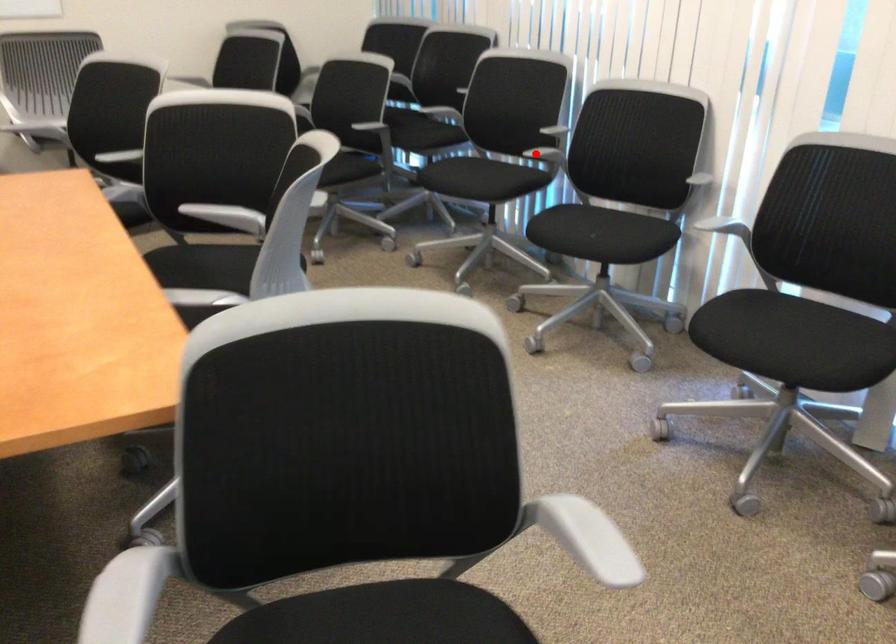
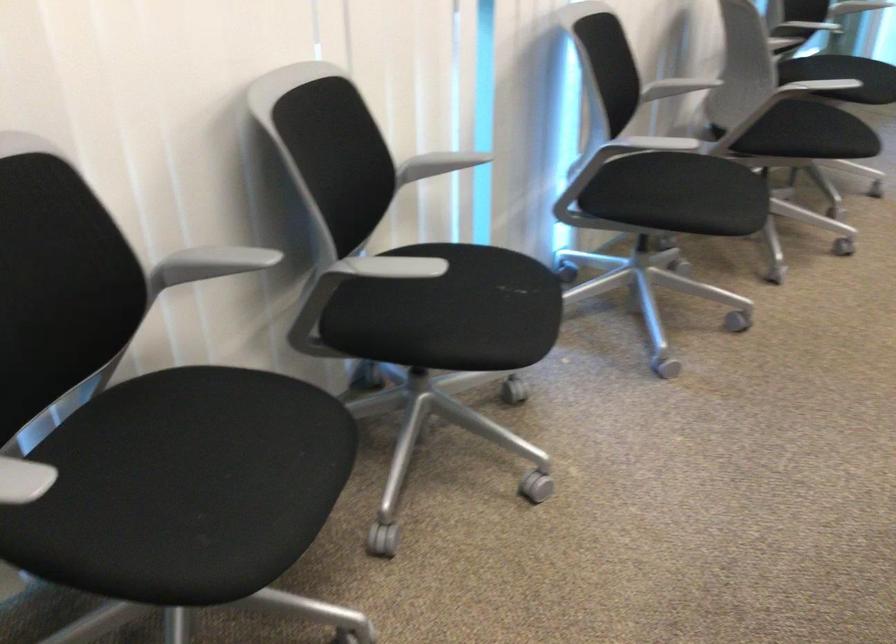
Find the pixel in the second image that matches the highlighted location in the first image.

(384, 267)